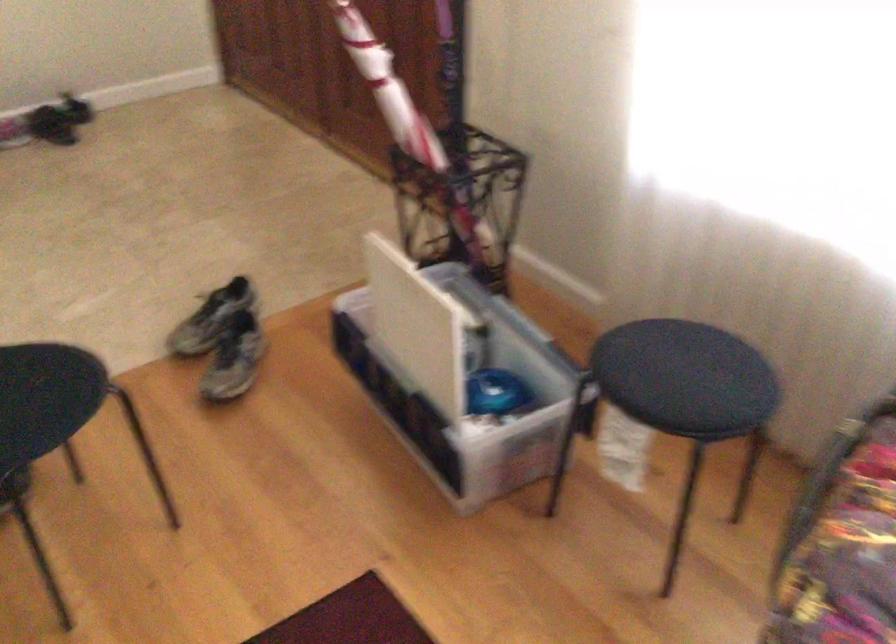
The image size is (896, 644). I want to click on white bin lid, so click(417, 327).